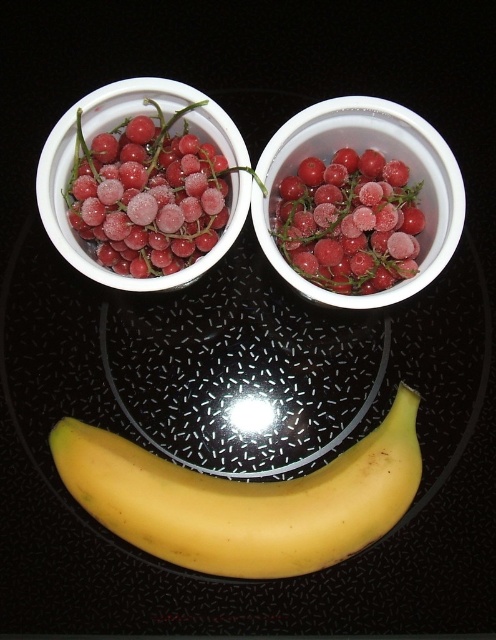
Can you confirm if yellow smooth banana at bottom is positioned to the left of frozen red berries at center?

Correct, you'll find yellow smooth banana at bottom to the left of frozen red berries at center.

Which is above, yellow smooth banana at bottom or frozen red berries at center?

frozen red berries at center

Image resolution: width=496 pixels, height=640 pixels. Find the location of `yellow smooth banana at bottom`. yellow smooth banana at bottom is located at coordinates (245, 499).

What do you see at coordinates (146, 195) in the screenshot? I see `frozen red berries at upper left` at bounding box center [146, 195].

Does point (136, 193) come behind point (361, 131)?

That is False.

At what (x,y) coordinates should I click in order to perform the action: click on frozen red berries at upper left. Please return your answer as a coordinate pair (x, y). This screenshot has width=496, height=640. Looking at the image, I should click on (146, 195).

Can you confirm if frozen red berries at upper left is smaller than frozen red berries at upper center?

No.

Does frozen red berries at upper left have a larger size compared to frozen red berries at upper center?

Indeed, frozen red berries at upper left has a larger size compared to frozen red berries at upper center.

Does point (104, 176) lie in front of point (361, 234)?

Yes, it is in front of point (361, 234).

Identify the location of frozen red berries at upper left. (146, 195).